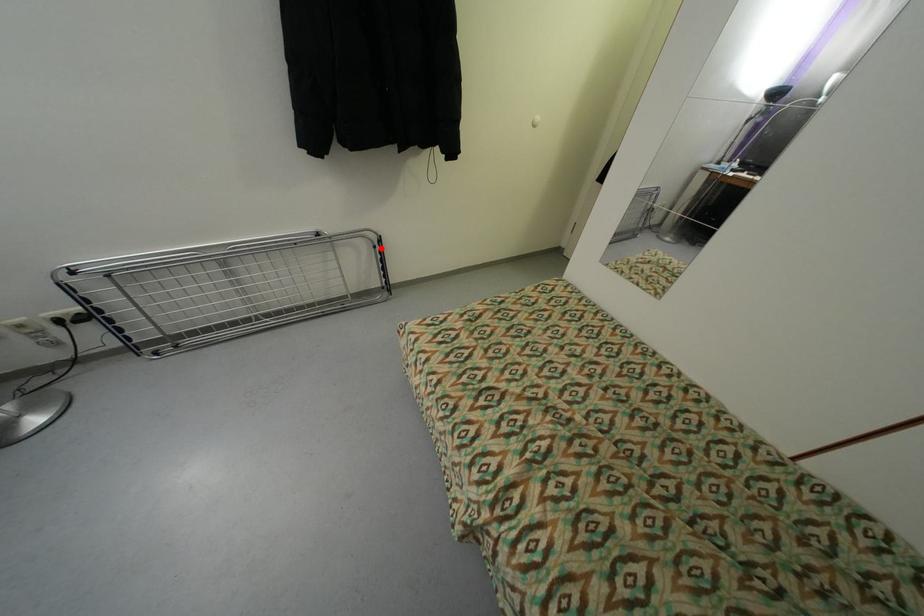
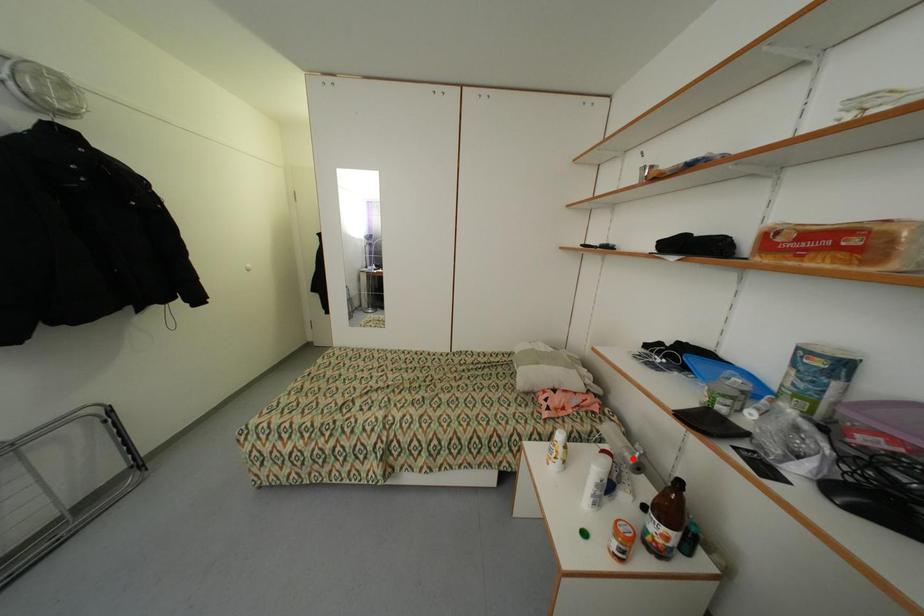
I am providing you with two images of the same scene from different viewpoints. A red point is marked on the first image and another point is marked on the second image. Is the red point in image1 aligned with the point shown in image2?

No